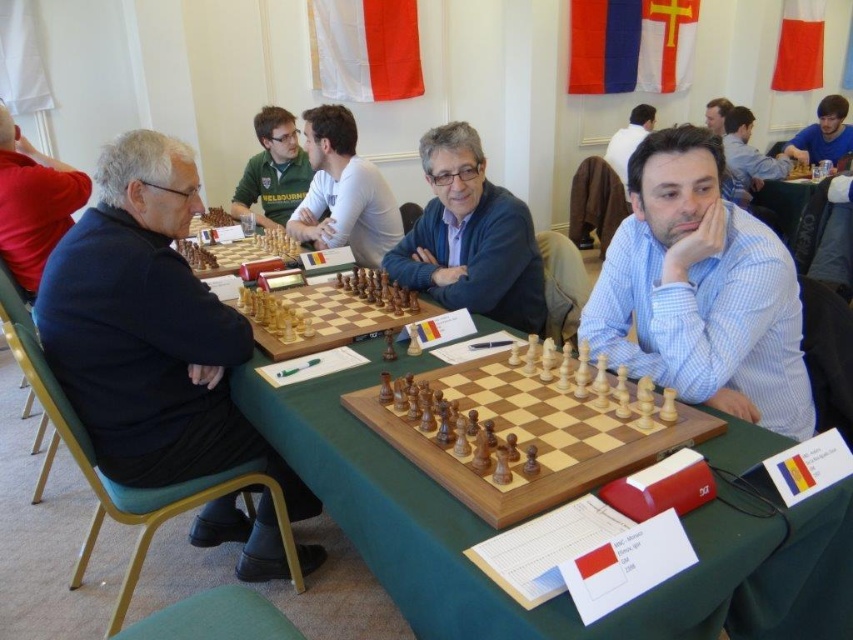
Question: Does matte black jacket at left have a larger size compared to blue shirt at center?

Choices:
 (A) no
 (B) yes

Answer: (A)

Question: Does wooden chessboard at center appear under matte blue sweater at center?

Choices:
 (A) yes
 (B) no

Answer: (A)

Question: Which object appears farthest from the camera in this image?

Choices:
 (A) black fabric jacket at left
 (B) green jersey at center
 (C) light blue checkered shirt at center

Answer: (B)

Question: Which object is positioned closest to the matte black shirt at upper center?

Choices:
 (A) blue shirt at center
 (B) blue shirt at upper right
 (C) light blue checkered shirt at center

Answer: (A)

Question: Does blue shirt at center appear on the left side of blue shirt at upper right?

Choices:
 (A) yes
 (B) no

Answer: (A)

Question: Which object is farther from the camera taking this photo?

Choices:
 (A) light blue checkered shirt at center
 (B) green jersey at center

Answer: (B)